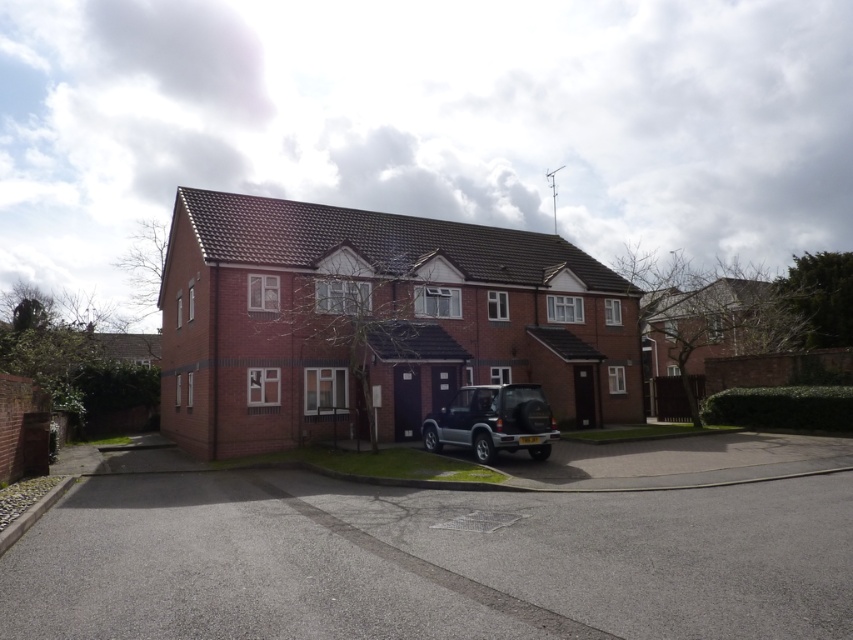
Question: Is gray asphalt driveway at center bigger than satin black suv at center?

Choices:
 (A) yes
 (B) no

Answer: (A)

Question: Among these objects, which one is farthest from the camera?

Choices:
 (A) satin black suv at center
 (B) gray asphalt driveway at center
 (C) brick house at center

Answer: (C)

Question: Which of the following is the farthest from the observer?

Choices:
 (A) (479, 396)
 (B) (537, 355)

Answer: (B)

Question: Does gray asphalt driveway at center appear on the right side of brick house at center?

Choices:
 (A) no
 (B) yes

Answer: (B)

Question: Is brick house at center closer to camera compared to satin black suv at center?

Choices:
 (A) yes
 (B) no

Answer: (B)

Question: Which object appears farthest from the camera in this image?

Choices:
 (A) gray asphalt driveway at center
 (B) brick house at center

Answer: (B)